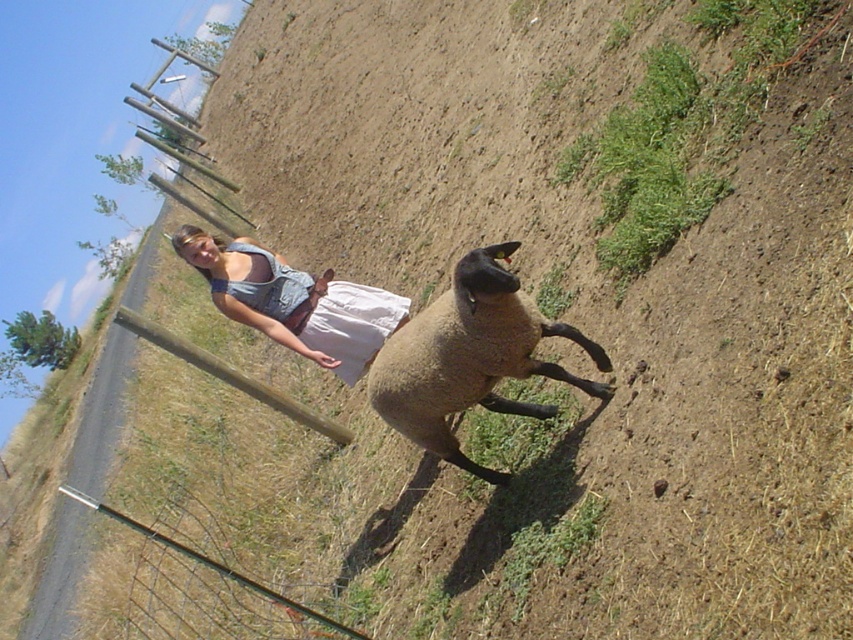
Question: Which of the following is the closest to the observer?

Choices:
 (A) (223, 572)
 (B) (332, 364)
 (C) (488, 477)

Answer: (A)

Question: Considering the relative positions of denim overalls at center and metal wire fence at lower left in the image provided, where is denim overalls at center located with respect to metal wire fence at lower left?

Choices:
 (A) above
 (B) below

Answer: (A)

Question: Based on their relative distances, which object is farther from the brown woolen sheep at center?

Choices:
 (A) metal wire fence at lower left
 (B) denim overalls at center

Answer: (A)

Question: Does brown woolen sheep at center appear over denim overalls at center?

Choices:
 (A) no
 (B) yes

Answer: (A)

Question: Can you confirm if brown woolen sheep at center is positioned to the left of metal wire fence at lower left?

Choices:
 (A) yes
 (B) no

Answer: (B)

Question: Which point is closer to the camera?

Choices:
 (A) (296, 611)
 (B) (560, 376)

Answer: (B)